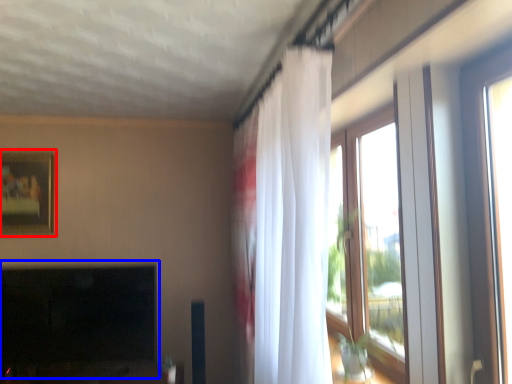
Question: Which object appears closest to the camera in this image, picture frame (highlighted by a red box) or fireplace (highlighted by a blue box)?

Choices:
 (A) picture frame
 (B) fireplace

Answer: (B)